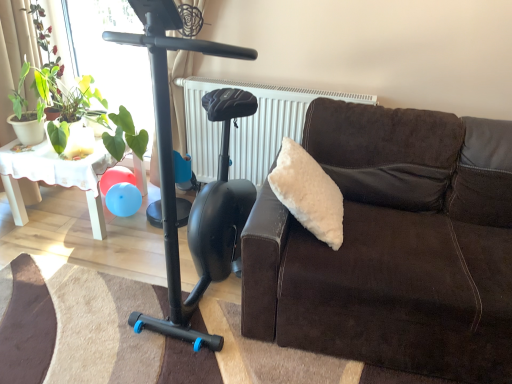
Question: Is green leafy plant at left, the 2th plant positioned from the left, inside the boundaries of white textured radiator at upper center, or outside?

Choices:
 (A) outside
 (B) inside

Answer: (A)

Question: In terms of size, does green leafy plant at left, the 1th plant positioned from the right, appear bigger or smaller than white textured radiator at upper center?

Choices:
 (A) small
 (B) big

Answer: (B)

Question: Which is nearer to the green leafy plant at upper left, the second plant positioned from the right?

Choices:
 (A) green leafy plant at left, the 1th plant positioned from the right
 (B) white textured radiator at upper center
 (C) white lace table at left
 (D) brown suede couch at right
 (E) black matte mobility scooter at left

Answer: (A)

Question: Considering the real-world distances, which object is closest to the white lace table at left?

Choices:
 (A) green leafy plant at upper left, the second plant positioned from the right
 (B) white textured radiator at upper center
 (C) black matte mobility scooter at left
 (D) brown suede couch at right
 (E) green leafy plant at left, the 1th plant positioned from the right

Answer: (E)